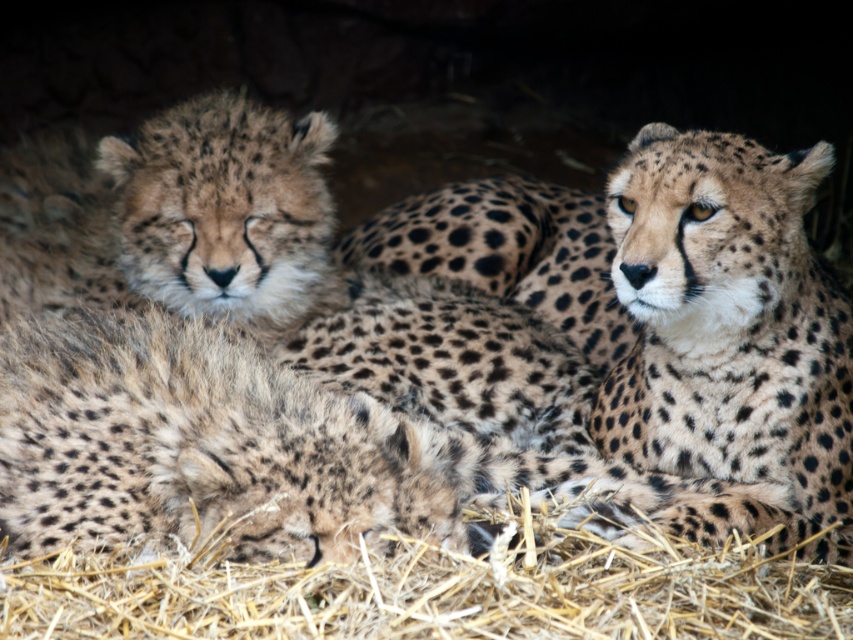
Question: Can you confirm if spotted fur cheetah at upper right is wider than brown straw at lower center?

Choices:
 (A) yes
 (B) no

Answer: (B)

Question: Observing the image, what is the correct spatial positioning of spotted fur cheetah at upper right in reference to brown straw at lower center?

Choices:
 (A) below
 (B) above

Answer: (B)

Question: In this image, where is spotted fur cheetah at upper right located relative to brown straw at lower center?

Choices:
 (A) below
 (B) above

Answer: (B)